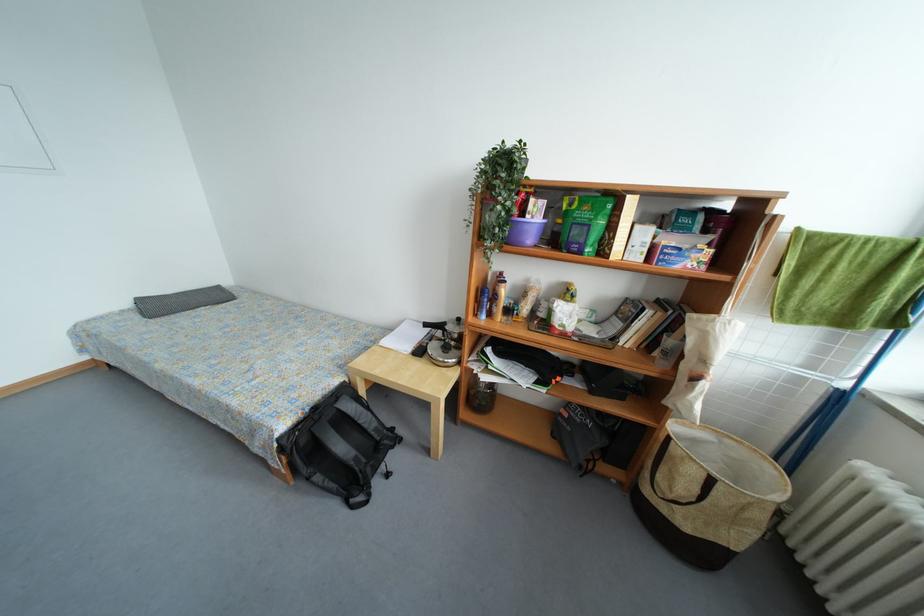
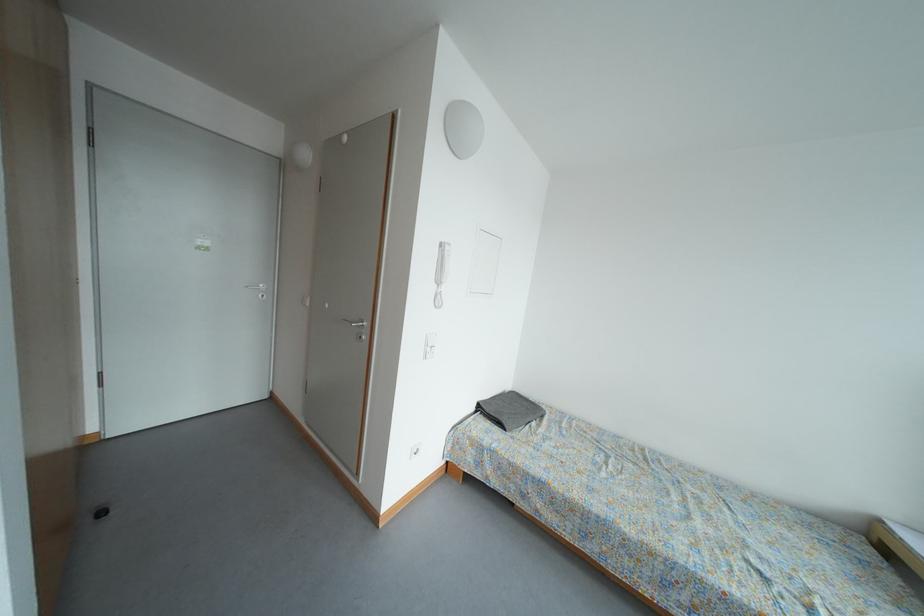
Question: In a continuous first-person perspective shot, in which direction is the camera moving?

Choices:
 (A) Left
 (B) Right
 (C) Forward
 (D) Backward

Answer: (A)